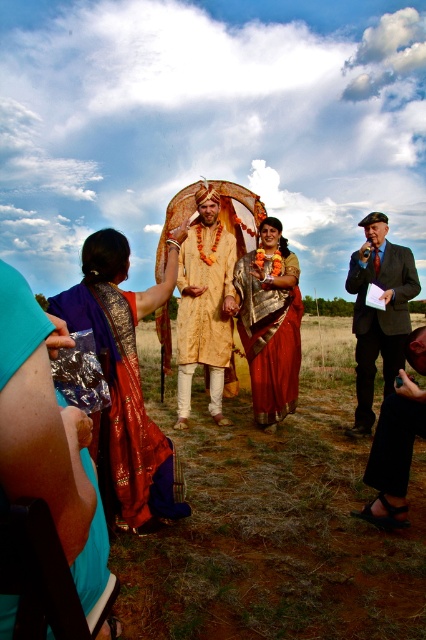
Between silky purple sari at left and gold brocade kurta at center, which one has less height?

silky purple sari at left

Who is higher up, silky purple sari at left or gold brocade kurta at center?

gold brocade kurta at center is higher up.

Does point (129, 356) come closer to viewer compared to point (222, 362)?

Yes, it is in front of point (222, 362).

Image resolution: width=426 pixels, height=640 pixels. I want to click on silky purple sari at left, so click(x=123, y=410).

Consider the image. Is silky red saree at center bigger than black leather sandals at lower right?

Yes, silky red saree at center is bigger than black leather sandals at lower right.

Does point (294, 305) come in front of point (400, 497)?

No.

What do you see at coordinates (268, 340) in the screenshot? The width and height of the screenshot is (426, 640). I see `silky red saree at center` at bounding box center [268, 340].

The width and height of the screenshot is (426, 640). I want to click on silky red saree at center, so click(268, 340).

Is silky purple sari at left above black leather sandals at lower right?

Yes, silky purple sari at left is above black leather sandals at lower right.

Does point (94, 310) come farther from viewer compared to point (403, 452)?

No, it is not.

You are a GUI agent. You are given a task and a screenshot of the screen. Output one action in this format:
    pyautogui.click(x=<x>, y=<y>)
    Task: Click on the silky purple sari at left
    This screenshot has height=640, width=426.
    Given the screenshot: What is the action you would take?
    pyautogui.click(x=123, y=410)